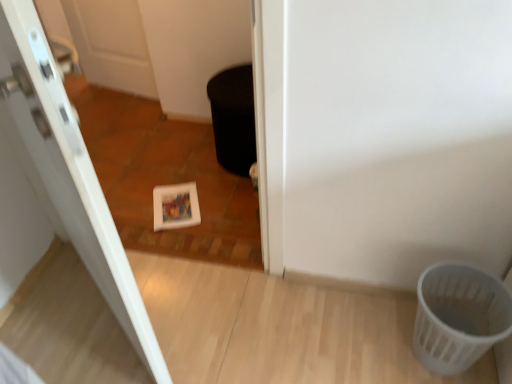
This screenshot has width=512, height=384. In order to click on free space that is to the left of white plastic basket at lower right in this screenshot , I will do `click(361, 342)`.